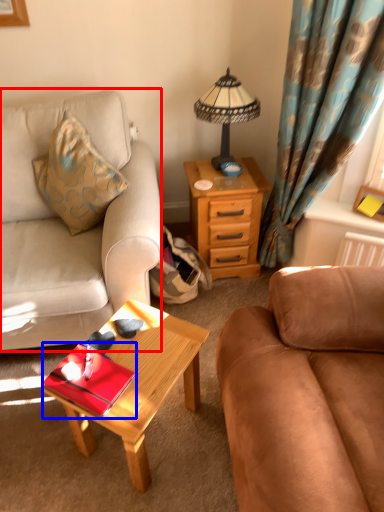
Question: Which object appears farthest to the camera in this image, studio couch (highlighted by a red box) or tray (highlighted by a blue box)?

Choices:
 (A) studio couch
 (B) tray

Answer: (A)